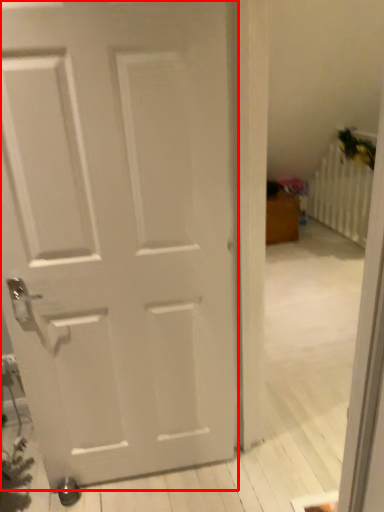
Question: In this image, where is door (annotated by the red box) located relative to radiator?

Choices:
 (A) right
 (B) left

Answer: (B)